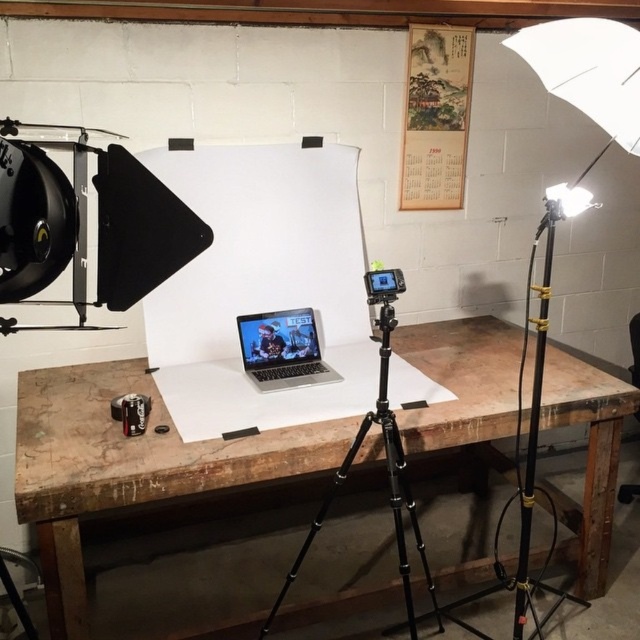
Question: Observing the image, what is the correct spatial positioning of wooden table at center in reference to white matte umbrella at upper right?

Choices:
 (A) right
 (B) left

Answer: (B)

Question: Does wooden table at center appear on the left side of white matte umbrella at upper right?

Choices:
 (A) yes
 (B) no

Answer: (A)

Question: Which point is closer to the camera?

Choices:
 (A) white matte umbrella at upper right
 (B) wooden table at center
 (C) black metal tripod at center
 (D) silver metallic laptop at center

Answer: (A)

Question: Which is nearer to the wooden table at center?

Choices:
 (A) silver metallic laptop at center
 (B) black metal tripod at center
 (C) white matte umbrella at upper right

Answer: (A)

Question: Is white matte umbrella at upper right thinner than silver metallic laptop at center?

Choices:
 (A) no
 (B) yes

Answer: (B)

Question: Among these objects, which one is farthest from the camera?

Choices:
 (A) wooden table at center
 (B) black metal tripod at center
 (C) silver metallic laptop at center

Answer: (C)